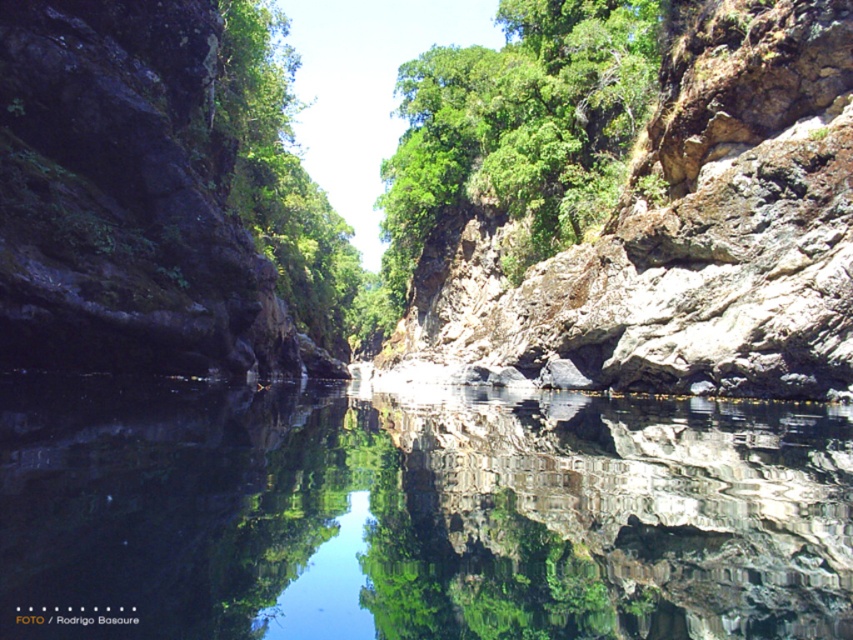
Question: Which point is closer to the camera?

Choices:
 (A) (830, 301)
 (B) (329, 205)
 (C) (523, 497)

Answer: (C)

Question: Which is nearer to the green leafy tree at center?

Choices:
 (A) clear water at center
 (B) rough rock cliff at upper right

Answer: (B)

Question: Is clear water at center closer to the viewer compared to rough rock cliff at upper right?

Choices:
 (A) yes
 (B) no

Answer: (A)

Question: Is clear water at center closer to camera compared to green leafy tree at center?

Choices:
 (A) no
 (B) yes

Answer: (B)

Question: Can you confirm if rough rock cliff at upper right is positioned to the left of green leafy tree at center?

Choices:
 (A) yes
 (B) no

Answer: (B)

Question: Which point appears farthest from the camera in this image?

Choices:
 (A) coord(614,272)
 (B) coord(593,566)
 (C) coord(329,304)

Answer: (C)